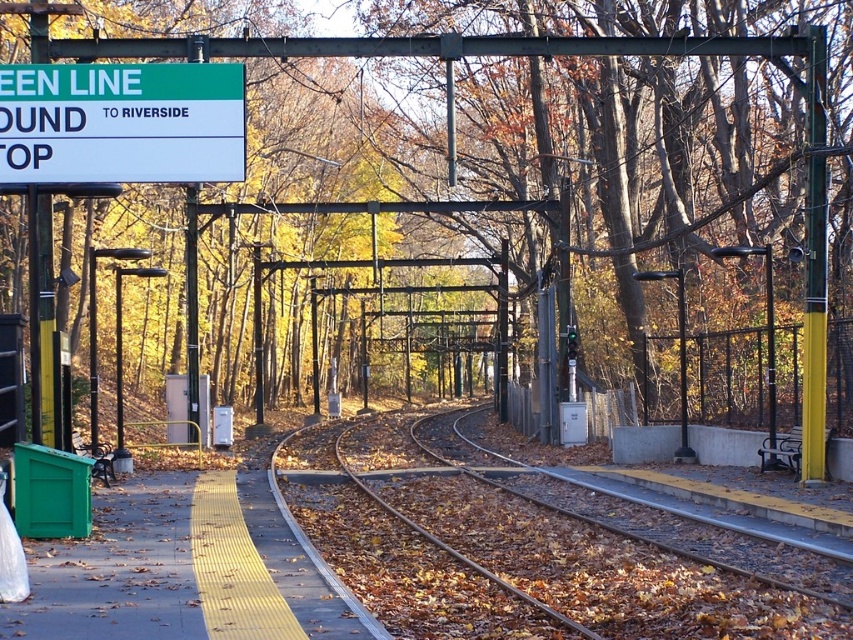
Can you confirm if brown leaf-covered tracks at center is wider than green plastic sign at upper left?

Correct, the width of brown leaf-covered tracks at center exceeds that of green plastic sign at upper left.

Is brown leaf-covered tracks at center to the left of green plastic sign at upper left from the viewer's perspective?

Incorrect, brown leaf-covered tracks at center is not on the left side of green plastic sign at upper left.

Between point (831, 595) and point (132, 177), which one is positioned in front?

Point (831, 595) is in front.

The image size is (853, 640). In order to click on brown leaf-covered tracks at center in this screenshot , I will do `click(602, 548)`.